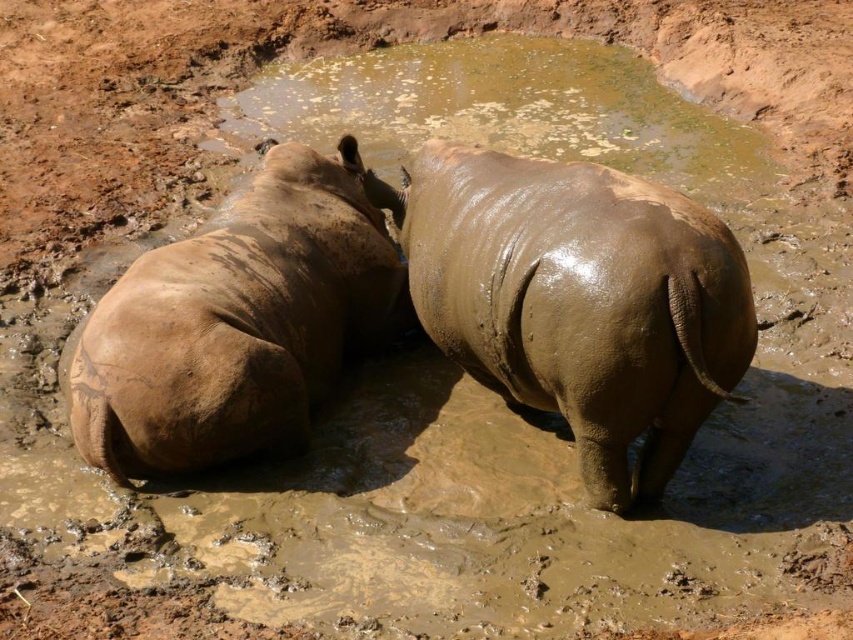
You are a wildlife photographer aiming to capture a closeup of the rhinos in the waterhole. You are currently standing at point (234, 205). To get the best shot, you need to move towards point (635, 490). However, the area between these two points is covered in muddy water. Will you be able to walk directly from your current position to the desired point without stepping into the muddy water?

Point (635, 490) is in front of point (234, 205). Since you are at point (234, 205), moving towards point (635, 490) would mean walking towards a position that is ahead of your current location. However, the path between them is covered in muddy water, so you would have to step into the muddy water to reach the desired point.

You are a wildlife photographer aiming to capture a closeup shot of the muddy wet rhinoceros at center. Given that your camera lens has a focal length of 200mm and you are currently 10 meters away from the rhinoceros, would you need to move closer or farther away to achieve a full body composition in your frame?

To achieve a full body composition of the muddy wet rhinoceros at center with a 200mm lens, you would need to move farther away from the rhinoceros. Being at 10 meters might make the rhinoceros appear too large in the frame for a full body shot, so increasing the distance would help capture the entire subject.